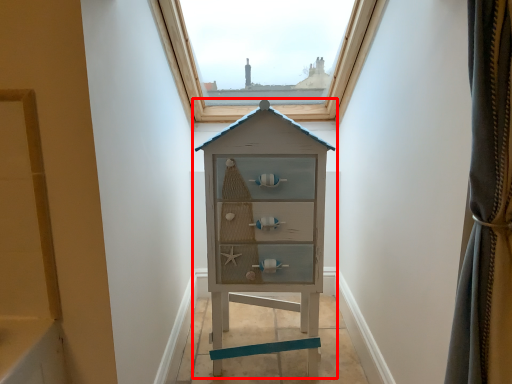
Question: From the image's perspective, where is chest of drawers (annotated by the red box) located in relation to window in the image?

Choices:
 (A) below
 (B) above

Answer: (A)